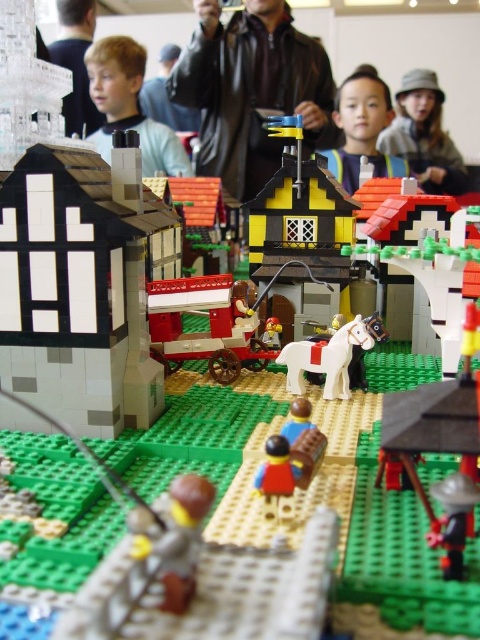
You are a Lego architect designing a new structure. You want to ensure that the new building doesn not block the view of the light brown hair at upper left from the yellow matte house at center. Based on the scene description, what should you consider about their heights?

The yellow matte house at center has a lesser height compared to light brown hair at upper left. Therefore, to prevent blocking the view, the new building should be shorter than the light brown hair at upper left to ensure the yellow matte house at center can still see it.

You are a Lego figure standing at the entrance of the village. You need to deliver a package to the yellow matte house at center. Which direction should you head towards from your current position?

The yellow matte house at center is located at point (x=301, y=230), so you should head towards the center of the village to reach it.

You are a Lego architect trying to design a new layout for the diorama. You have to place the yellow matte house at center and the light brown hair at upper left. Based on their sizes, which object should you place first to ensure they fit properly?

The yellow matte house at center occupies less space than the light brown hair at upper left, so you should place the light brown hair at upper left first since it requires more space.